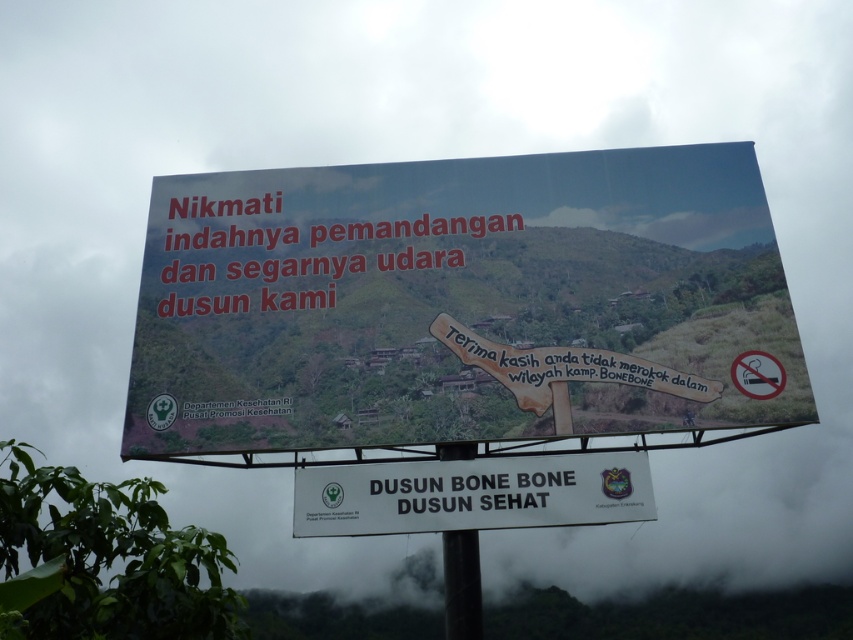
Question: Which point is closer to the camera?

Choices:
 (A) (462, 173)
 (B) (566, 513)

Answer: (B)

Question: Which point is farther to the camera?

Choices:
 (A) white plastic billboard at upper center
 (B) white plastic signboard at center
 (C) black metal pole at center

Answer: (A)

Question: Can you confirm if white plastic billboard at upper center is positioned below white plastic signboard at center?

Choices:
 (A) yes
 (B) no

Answer: (B)

Question: Which point is closer to the camera?

Choices:
 (A) black metal pole at center
 (B) white plastic signboard at center
 (C) white plastic billboard at upper center

Answer: (B)

Question: Is white plastic billboard at upper center thinner than white plastic signboard at center?

Choices:
 (A) yes
 (B) no

Answer: (B)

Question: Does white plastic signboard at center appear over black metal pole at center?

Choices:
 (A) yes
 (B) no

Answer: (A)